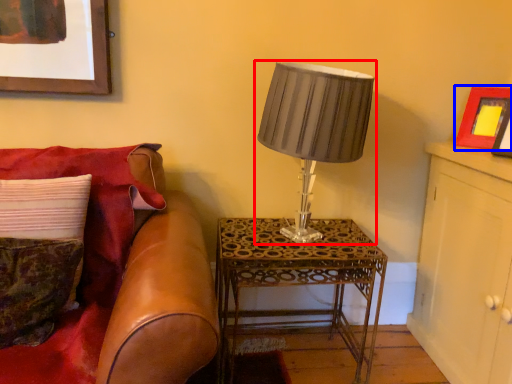
Question: Among these objects, which one is farthest to the camera, lamp (highlighted by a red box) or picture frame (highlighted by a blue box)?

Choices:
 (A) lamp
 (B) picture frame

Answer: (B)